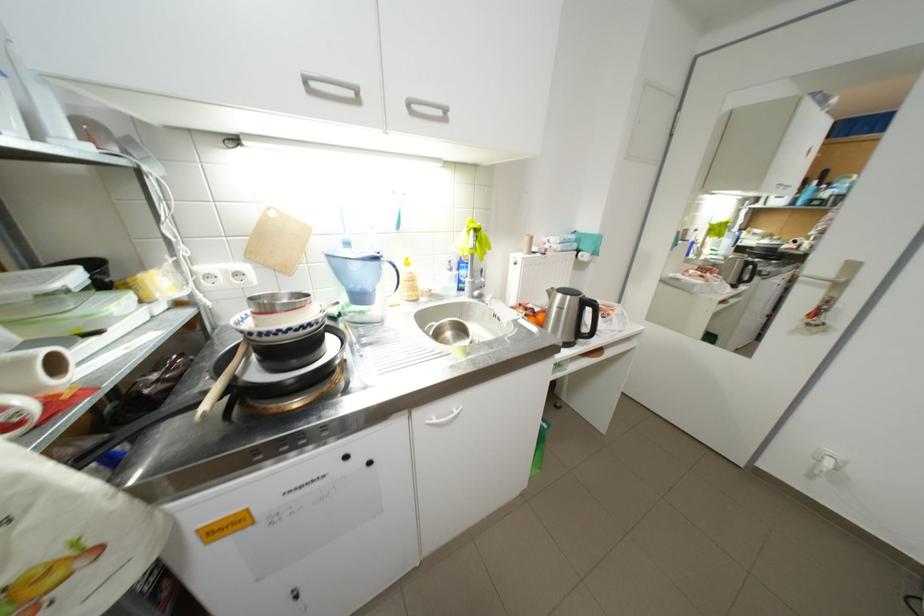
Find where to lift the kettle handle. Please return your answer as a coordinate pair (x, y).

(361, 283)